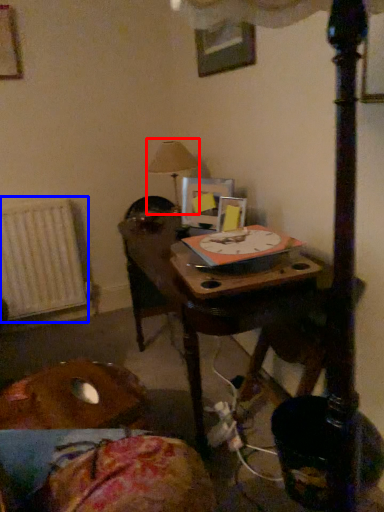
Question: Which object is further to the camera taking this photo, table lamp (highlighted by a red box) or radiator (highlighted by a blue box)?

Choices:
 (A) table lamp
 (B) radiator

Answer: (B)